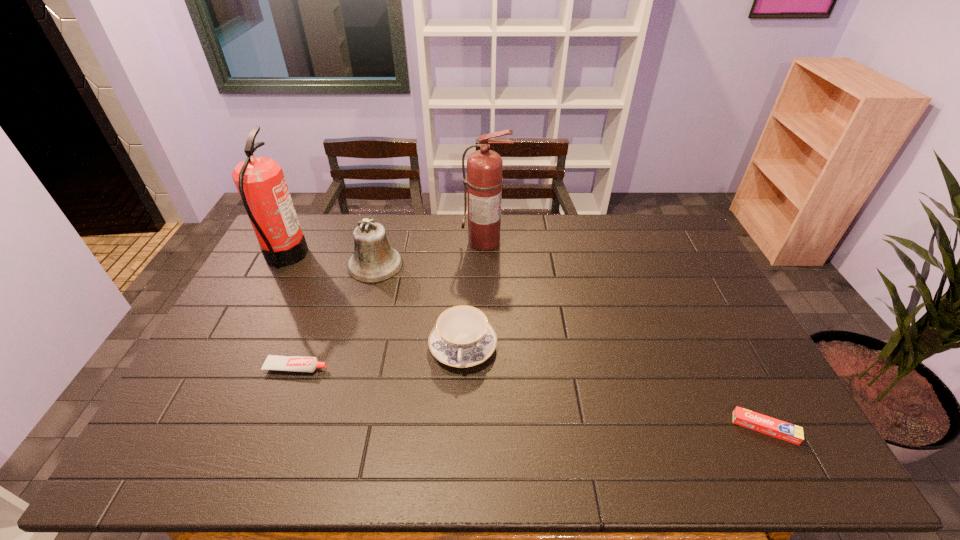
Locate an element on the screen. This screenshot has width=960, height=540. vacant space at the far edge of the desktop is located at coordinates (415, 224).

This screenshot has height=540, width=960. Find the location of `vacant space at the left edge of the desktop`. vacant space at the left edge of the desktop is located at coordinates (261, 342).

The image size is (960, 540). In the image, there is a desktop. What are the coordinates of `vacant area at the right edge` in the screenshot? It's located at (724, 387).

The image size is (960, 540). I want to click on free spot between the fourth shortest object and the shortest object, so click(570, 346).

This screenshot has width=960, height=540. Find the location of `empty location between the right toothpaste and the left toothpaste`. empty location between the right toothpaste and the left toothpaste is located at coordinates (531, 397).

Image resolution: width=960 pixels, height=540 pixels. In order to click on unoccupied area between the left fire extinguisher and the third tallest object in this screenshot , I will do `click(330, 261)`.

Locate an element on the screen. vacant space in between the bell and the shortest object is located at coordinates (570, 346).

The height and width of the screenshot is (540, 960). I want to click on empty space that is in between the taller toothpaste and the nearer toothpaste, so click(x=531, y=397).

Where is `vacant area that lies between the leftmost object and the bell`? The width and height of the screenshot is (960, 540). vacant area that lies between the leftmost object and the bell is located at coordinates (330, 261).

Identify the location of free point between the bell and the right fire extinguisher. This screenshot has height=540, width=960. (430, 253).